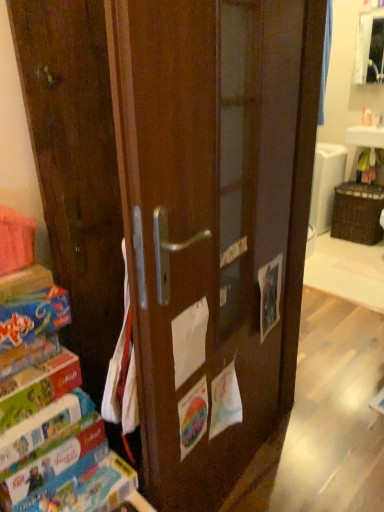
Question: Considering the relative positions of matte cardboard book at lower left, positioned as the 2th paperback book in top-to-bottom order, and matte brown cabinet at upper right in the image provided, is matte cardboard book at lower left, positioned as the 2th paperback book in top-to-bottom order, in front of matte brown cabinet at upper right?

Choices:
 (A) no
 (B) yes

Answer: (B)

Question: Can you confirm if matte cardboard book at lower left, positioned as the 2th paperback book in top-to-bottom order, is shorter than matte brown cabinet at upper right?

Choices:
 (A) yes
 (B) no

Answer: (A)

Question: Considering the relative sizes of matte cardboard book at lower left, arranged as the third paperback book when ordered from the bottom, and matte brown cabinet at upper right in the image provided, is matte cardboard book at lower left, arranged as the third paperback book when ordered from the bottom, bigger than matte brown cabinet at upper right?

Choices:
 (A) yes
 (B) no

Answer: (B)

Question: Is matte cardboard book at lower left, positioned as the 2th paperback book in top-to-bottom order, facing towards matte brown cabinet at upper right?

Choices:
 (A) yes
 (B) no

Answer: (B)

Question: Considering the relative positions of matte cardboard book at lower left, arranged as the third paperback book when ordered from the bottom, and matte brown cabinet at upper right in the image provided, is matte cardboard book at lower left, arranged as the third paperback book when ordered from the bottom, to the right of matte brown cabinet at upper right from the viewer's perspective?

Choices:
 (A) yes
 (B) no

Answer: (B)

Question: Is matte cardboard book at lower left, positioned as the 2th paperback book in top-to-bottom order, wider than matte brown cabinet at upper right?

Choices:
 (A) no
 (B) yes

Answer: (B)

Question: Considering the relative positions of matte cardboard book at lower left, acting as the 2th paperback book starting from the bottom, and hardcover book at left, which is the 1th paperback book in bottom-to-top order, in the image provided, is matte cardboard book at lower left, acting as the 2th paperback book starting from the bottom, to the right of hardcover book at left, which is the 1th paperback book in bottom-to-top order, from the viewer's perspective?

Choices:
 (A) yes
 (B) no

Answer: (B)

Question: Is matte cardboard book at lower left, arranged as the third paperback book when viewed from the top, positioned before hardcover book at left, which ranks as the fourth paperback book in top-to-bottom order?

Choices:
 (A) yes
 (B) no

Answer: (A)

Question: Is matte cardboard book at lower left, arranged as the third paperback book when viewed from the top, oriented away from hardcover book at left, which is the 1th paperback book in bottom-to-top order?

Choices:
 (A) no
 (B) yes

Answer: (A)

Question: From a real-world perspective, is matte cardboard book at lower left, acting as the 2th paperback book starting from the bottom, beneath hardcover book at left, which is the 1th paperback book in bottom-to-top order?

Choices:
 (A) yes
 (B) no

Answer: (B)

Question: Would you say matte cardboard book at lower left, acting as the 2th paperback book starting from the bottom, is outside hardcover book at left, which ranks as the fourth paperback book in top-to-bottom order?

Choices:
 (A) no
 (B) yes

Answer: (B)

Question: Is matte cardboard book at lower left, arranged as the third paperback book when viewed from the top, next to hardcover book at left, which ranks as the fourth paperback book in top-to-bottom order?

Choices:
 (A) no
 (B) yes

Answer: (B)

Question: Is matte brown cabinet at upper right surrounding matte cardboard book at left, which is counted as the 1th paperback book, starting from the top?

Choices:
 (A) no
 (B) yes

Answer: (A)